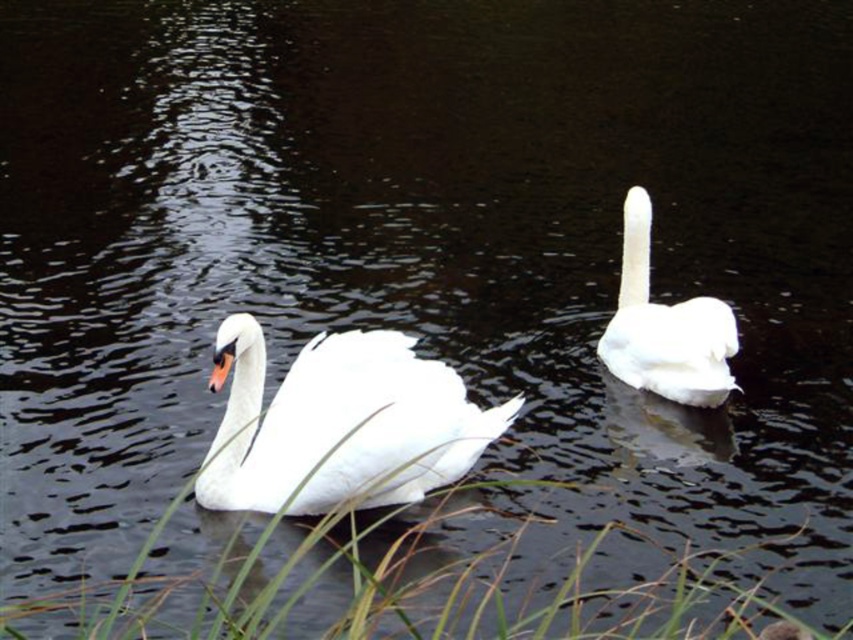
What are the coordinates of `white glossy swan at center` in the screenshot? It's located at (339, 422).

Is white glossy swan at center thinner than white feathered swan at right?

Incorrect, white glossy swan at center's width is not less than white feathered swan at right's.

Locate an element on the screen. The height and width of the screenshot is (640, 853). white glossy swan at center is located at coordinates (339, 422).

You are a GUI agent. You are given a task and a screenshot of the screen. Output one action in this format:
    pyautogui.click(x=<x>, y=<y>)
    Task: Click on the white glossy swan at center
    The image size is (853, 640).
    Given the screenshot: What is the action you would take?
    pyautogui.click(x=339, y=422)